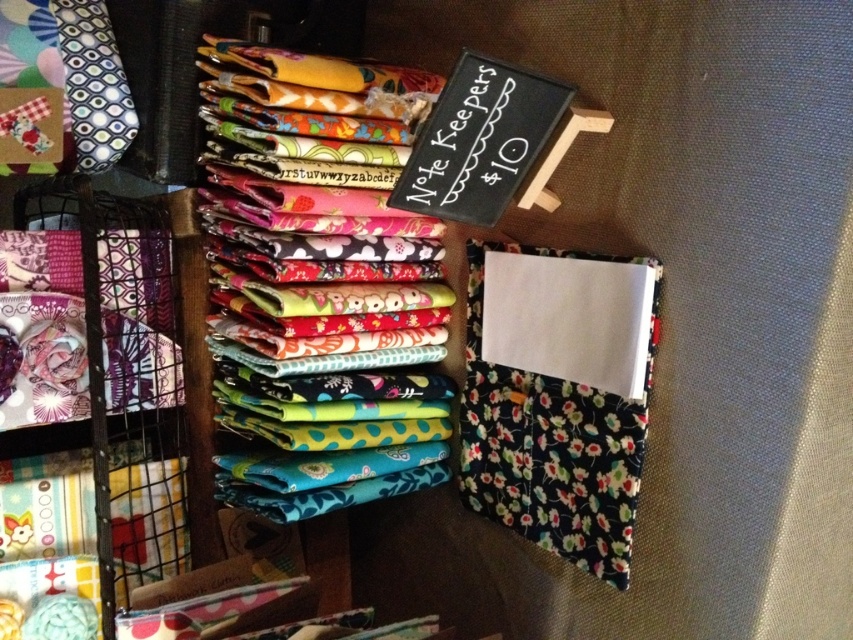
Consider the image. You are standing in front of a display of colorful notebooks and want to reach a specific point on the shelf. The point is located at coordinates point (x=258, y=115). Considering your arm can extend 2.5 feet, can you reach that point without moving closer?

The distance between point (x=258, y=115) and the camera is 3.44 feet, which is farther than your arm can reach 2.5 feet. Therefore, you cannot reach the point without moving closer.

You are standing in front of the shelf with colorful notebooks and a chalkboard sign. You notice two points marked on the shelf. The first point is at coordinate point (463, 147) and the second is at point (109, 44). From your perspective, which point is closer to you?

Point (463, 147) is in front of point (109, 44), so it is closer to you.

You are organizing a display of notebooks and need to ensure that two specific items are spaced correctly. The vibrant printed fabric at center and the patterned fabric tie at upper left must be placed exactly 12 inches apart. Based on the current arrangement shown in the image, will you need to move these items closer together or farther apart to meet the requirement?

The vibrant printed fabric at center is currently 13.42 inches away from the patterned fabric tie at upper left. To meet the 12 inch requirement, you need to move them closer together by 1.42 inches.